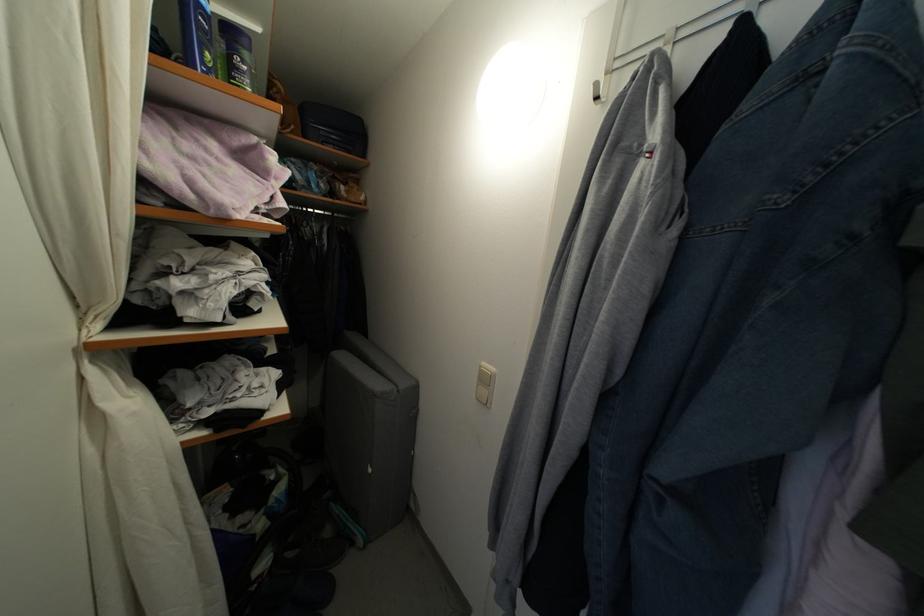
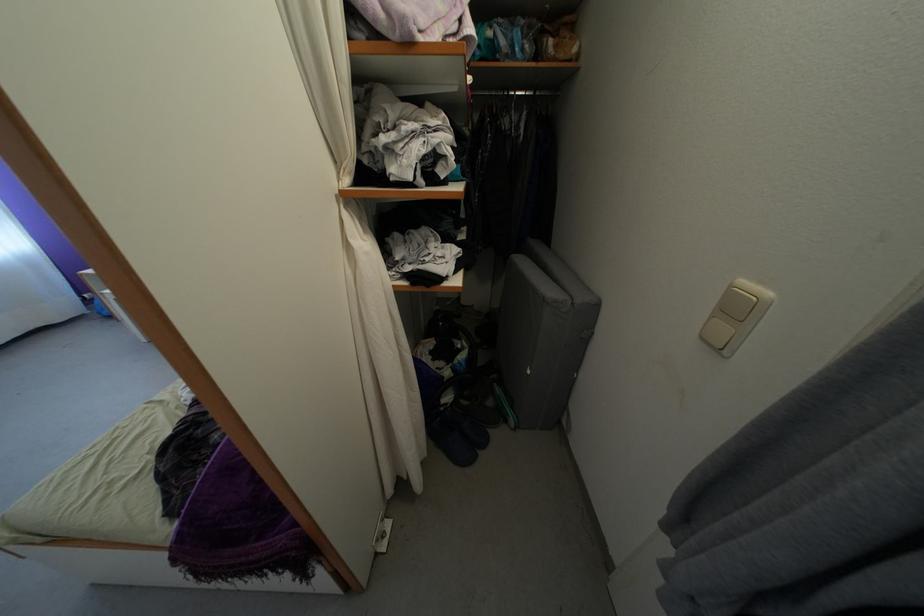
Find the pixel in the second image that matches point 342,221 in the first image.

(543, 98)